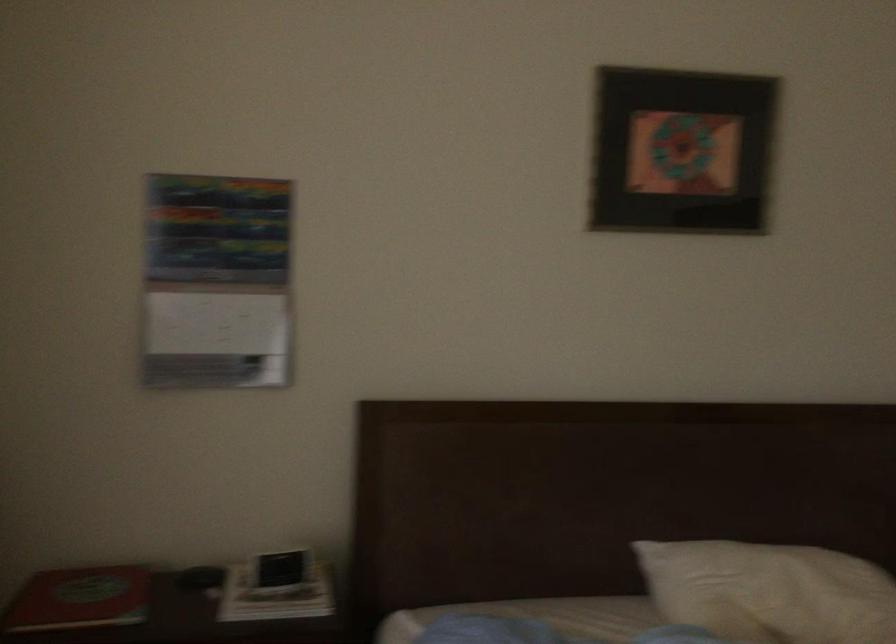
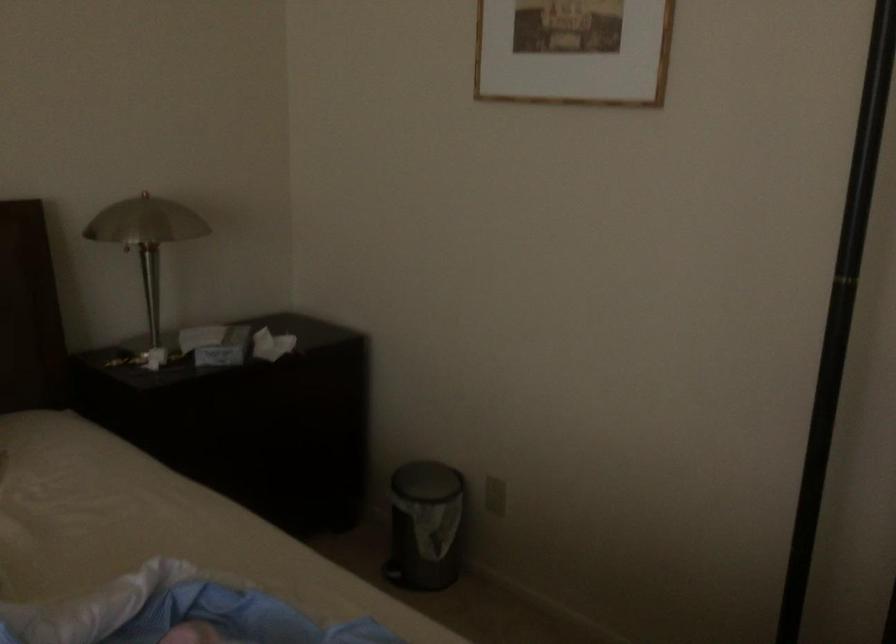
Question: The images are taken continuously from a first-person perspective. In which direction is your viewpoint rotating?

Choices:
 (A) Left
 (B) Right
 (C) Up
 (D) Down

Answer: (B)